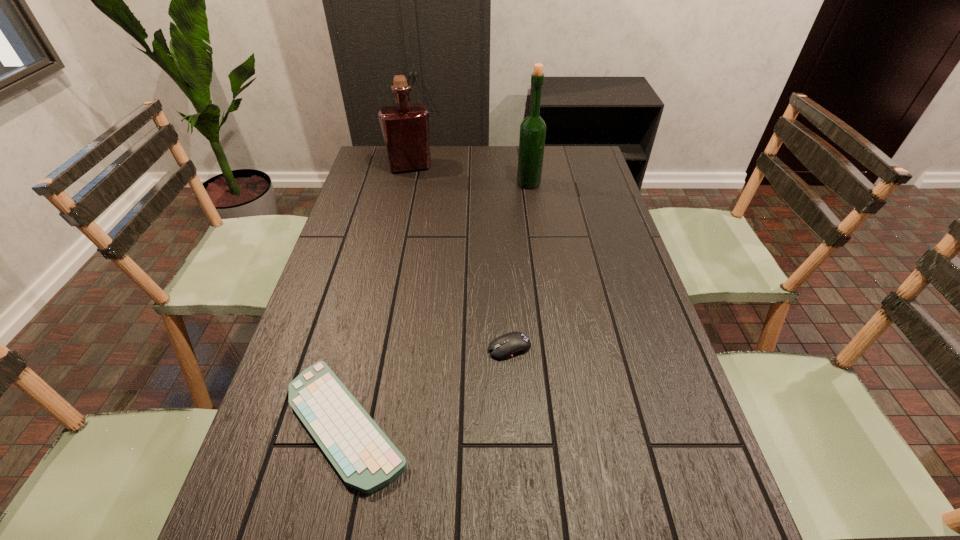
Identify the location of the right liquor. (533, 128).

You are a GUI agent. You are given a task and a screenshot of the screen. Output one action in this format:
    pyautogui.click(x=<x>, y=<y>)
    Task: Click on the second farthest object
    
    Given the screenshot: What is the action you would take?
    pyautogui.click(x=533, y=128)

You are a GUI agent. You are given a task and a screenshot of the screen. Output one action in this format:
    pyautogui.click(x=<x>, y=<y>)
    Task: Click on the left liquor
    This screenshot has height=540, width=960.
    Given the screenshot: What is the action you would take?
    pyautogui.click(x=405, y=127)

Where is `the farther liquor`? The height and width of the screenshot is (540, 960). the farther liquor is located at coordinates (405, 127).

Where is `the second shortest object`? The width and height of the screenshot is (960, 540). the second shortest object is located at coordinates (506, 346).

Where is `the third object from left to right`? the third object from left to right is located at coordinates (506, 346).

I want to click on the shortest object, so click(x=364, y=457).

The image size is (960, 540). What are the coordinates of `the nearest object` in the screenshot? It's located at (364, 457).

This screenshot has width=960, height=540. Identify the location of vacant space located on the front of the right liquor. (539, 252).

In order to click on vacant space located 0.260m on the front of the second tallest object in this screenshot , I will do [x=399, y=217].